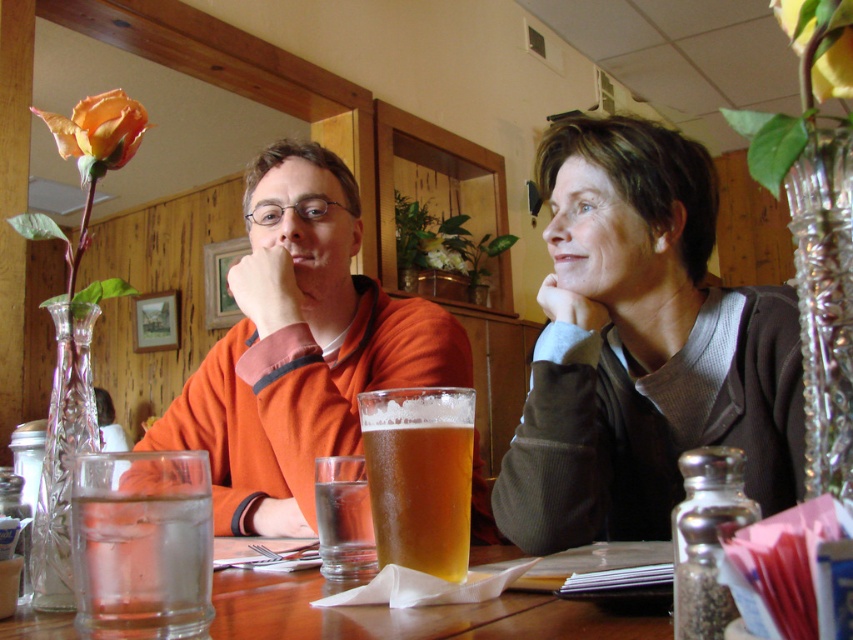
Question: Estimate the real-world distances between objects in this image. Which object is closer to the translucent glass table at center?

Choices:
 (A) golden matte glass at center
 (B) clear glass beer at center
 (C) matte orange sweater at center

Answer: (A)

Question: Does golden matte glass at center appear on the right side of clear glass beer at center?

Choices:
 (A) yes
 (B) no

Answer: (A)

Question: Is dark brown sweater at upper right to the left of translucent glass table at center from the viewer's perspective?

Choices:
 (A) yes
 (B) no

Answer: (B)

Question: Which point is closer to the camera?

Choices:
 (A) (606, 188)
 (B) (598, 220)

Answer: (A)

Question: Considering the real-world distances, which object is closest to the golden matte glass at center?

Choices:
 (A) translucent glass table at center
 (B) clear glass water at lower left

Answer: (A)

Question: Does dark brown sweater at upper right have a larger size compared to clear glass water at lower left?

Choices:
 (A) yes
 (B) no

Answer: (A)